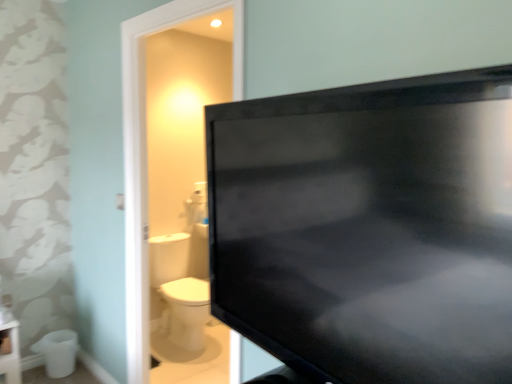
This screenshot has width=512, height=384. What do you see at coordinates (58, 352) in the screenshot?
I see `white glossy toilet bowl at lower left` at bounding box center [58, 352].

Where is `white glossy toilet bowl at lower left`? This screenshot has width=512, height=384. white glossy toilet bowl at lower left is located at coordinates (58, 352).

Describe the element at coordinates (368, 228) in the screenshot. I see `black glossy tv at upper right` at that location.

Find the location of a particular element. The height and width of the screenshot is (384, 512). black glossy tv at upper right is located at coordinates (368, 228).

Locate an element on the screen. white glossy toilet bowl at lower left is located at coordinates (58, 352).

Visually, is white glossy toilet bowl at lower left positioned to the left or to the right of black glossy tv at upper right?

white glossy toilet bowl at lower left is to the left of black glossy tv at upper right.

Which object is further away from the camera, white glossy toilet bowl at lower left or black glossy tv at upper right?

white glossy toilet bowl at lower left.

Which point is more forward, [45,363] or [335,366]?

The point [335,366] is closer to the camera.

From the image's perspective, which one is positioned lower, white glossy toilet bowl at lower left or black glossy tv at upper right?

white glossy toilet bowl at lower left is shown below in the image.

From a real-world perspective, between white glossy toilet bowl at lower left and black glossy tv at upper right, who is vertically lower?

white glossy toilet bowl at lower left is physically lower.

Considering the sizes of objects white glossy toilet bowl at lower left and black glossy tv at upper right in the image provided, who is wider, white glossy toilet bowl at lower left or black glossy tv at upper right?

With larger width is white glossy toilet bowl at lower left.

Considering the relative sizes of white glossy toilet bowl at lower left and black glossy tv at upper right in the image provided, is white glossy toilet bowl at lower left taller than black glossy tv at upper right?

Incorrect, the height of white glossy toilet bowl at lower left is not larger of that of black glossy tv at upper right.

Can you confirm if white glossy toilet bowl at lower left is smaller than black glossy tv at upper right?

Indeed, white glossy toilet bowl at lower left has a smaller size compared to black glossy tv at upper right.

Which is correct: white glossy toilet bowl at lower left is inside black glossy tv at upper right, or outside of it?

white glossy toilet bowl at lower left cannot be found inside black glossy tv at upper right.

Is white glossy toilet bowl at lower left positioned far away from black glossy tv at upper right?

Indeed, white glossy toilet bowl at lower left is not near black glossy tv at upper right.

Is white glossy toilet bowl at lower left turned away from black glossy tv at upper right?

white glossy toilet bowl at lower left is not turned away from black glossy tv at upper right.

Can you tell me how much white glossy toilet bowl at lower left and black glossy tv at upper right differ in facing direction?

The angular difference between white glossy toilet bowl at lower left and black glossy tv at upper right is 96.1 degrees.

The width and height of the screenshot is (512, 384). Identify the location of toilet bowl to the left of black glossy tv at upper right. (58, 352).

Considering the relative positions of black glossy tv at upper right and white glossy toilet bowl at lower left in the image provided, is black glossy tv at upper right to the left or to the right of white glossy toilet bowl at lower left?

black glossy tv at upper right is to the right of white glossy toilet bowl at lower left.

Does black glossy tv at upper right come in front of white glossy toilet bowl at lower left?

Yes, black glossy tv at upper right is in front of white glossy toilet bowl at lower left.

Which point is more distant from viewer, (x=342, y=193) or (x=72, y=347)?

The point (x=72, y=347) is farther from the camera.

From the image's perspective, between black glossy tv at upper right and white glossy toilet bowl at lower left, who is located below?

From the image's view, white glossy toilet bowl at lower left is below.

From a real-world perspective, which object rests below the other?

white glossy toilet bowl at lower left is physically lower.

Does black glossy tv at upper right have a lesser width compared to white glossy toilet bowl at lower left?

Yes.

Does black glossy tv at upper right have a lesser height compared to white glossy toilet bowl at lower left?

No, black glossy tv at upper right is not shorter than white glossy toilet bowl at lower left.

Consider the image. Which of these two, black glossy tv at upper right or white glossy toilet bowl at lower left, is smaller?

With smaller size is white glossy toilet bowl at lower left.

Which is correct: black glossy tv at upper right is inside white glossy toilet bowl at lower left, or outside of it?

black glossy tv at upper right cannot be found inside white glossy toilet bowl at lower left.

Are black glossy tv at upper right and white glossy toilet bowl at lower left beside each other?

No, black glossy tv at upper right is not in contact with white glossy toilet bowl at lower left.

Could you tell me if black glossy tv at upper right is turned towards white glossy toilet bowl at lower left?

No, black glossy tv at upper right is not oriented towards white glossy toilet bowl at lower left.

In the scene shown: What's the angular difference between black glossy tv at upper right and white glossy toilet bowl at lower left's facing directions?

They differ by 96.1 degrees in their facing directions.

I want to click on television that is above the white glossy toilet bowl at lower left (from the image's perspective), so click(368, 228).

Where is `toilet bowl that appears on the left of black glossy tv at upper right`? toilet bowl that appears on the left of black glossy tv at upper right is located at coordinates (58, 352).

In the image, there is a white glossy toilet bowl at lower left. At what (x,y) coordinates should I click in order to perform the action: click on television above it (from the image's perspective). Please return your answer as a coordinate pair (x, y). The height and width of the screenshot is (384, 512). Looking at the image, I should click on (368, 228).